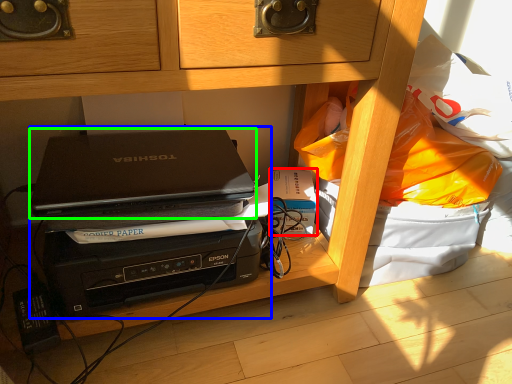
Question: Considering the real-world distances, which object is farthest from paperback book (highlighted by a red box)? computer (highlighted by a blue box) or laptop (highlighted by a green box)?

Choices:
 (A) computer
 (B) laptop

Answer: (A)